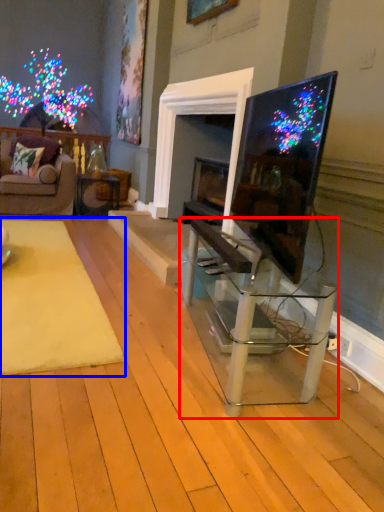
Question: Which object appears farthest to the camera in this image, table (highlighted by a red box) or mat (highlighted by a blue box)?

Choices:
 (A) table
 (B) mat

Answer: (B)